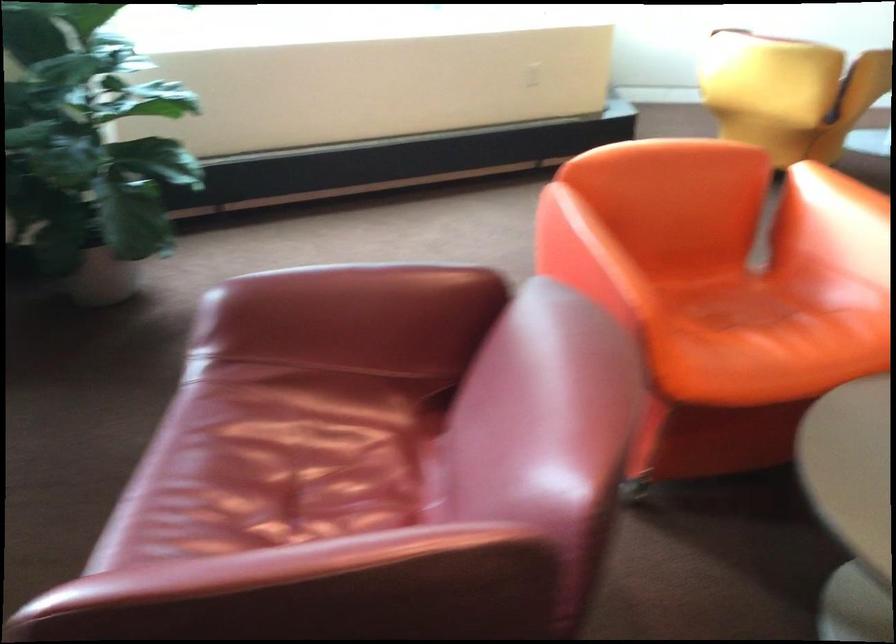
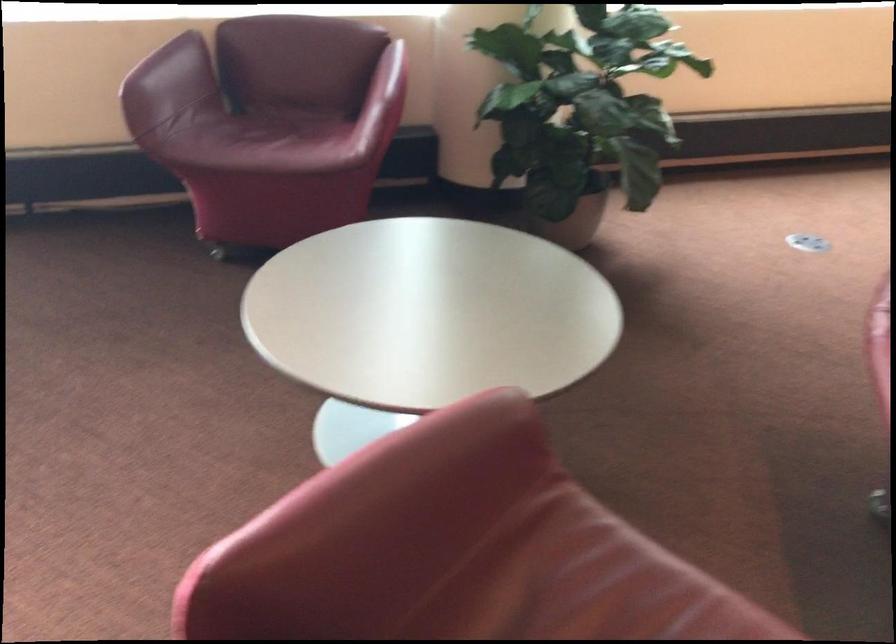
The point at (x=84, y=289) is marked in the first image. Where is the corresponding point in the second image?

(573, 223)